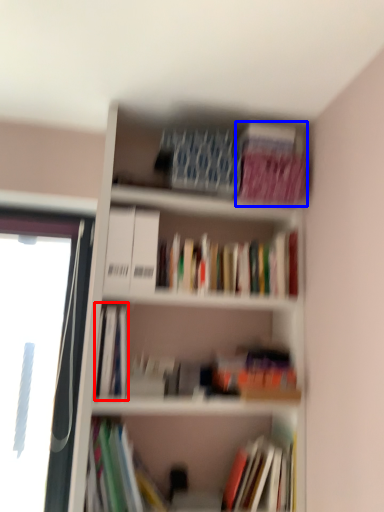
Question: Among these objects, which one is farthest to the camera, book (highlighted by a red box) or paperback book (highlighted by a blue box)?

Choices:
 (A) book
 (B) paperback book

Answer: (B)